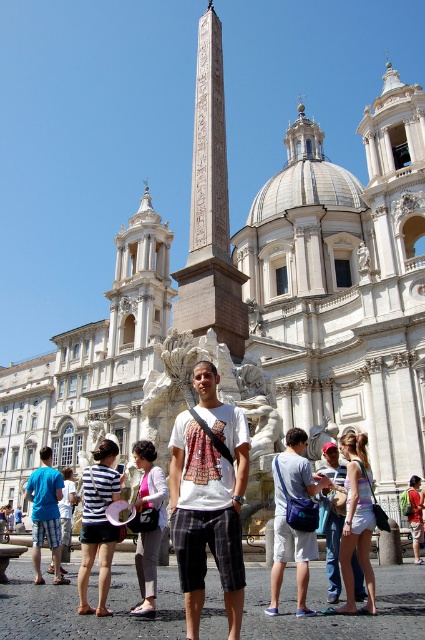
Question: Is white printed t-shirt at center thinner than red shirt at center?

Choices:
 (A) no
 (B) yes

Answer: (A)

Question: Does white cotton tank top at center appear under blue cotton t-shirt at center?

Choices:
 (A) yes
 (B) no

Answer: (B)

Question: Among these objects, which one is farthest from the camera?

Choices:
 (A) carved stone obelisk at center
 (B) blue cotton t-shirt at center
 (C) white cotton tank top at center

Answer: (A)

Question: Which point is farther to the camera?

Choices:
 (A) carved stone obelisk at center
 (B) striped cotton shirt at center
 (C) white cotton tank top at center

Answer: (A)

Question: Which point appears closest to the camera in this image?

Choices:
 (A) 70,490
 (B) 373,588

Answer: (B)

Question: Is carved stone obelisk at center positioned before blue cotton t-shirt at center?

Choices:
 (A) no
 (B) yes

Answer: (A)